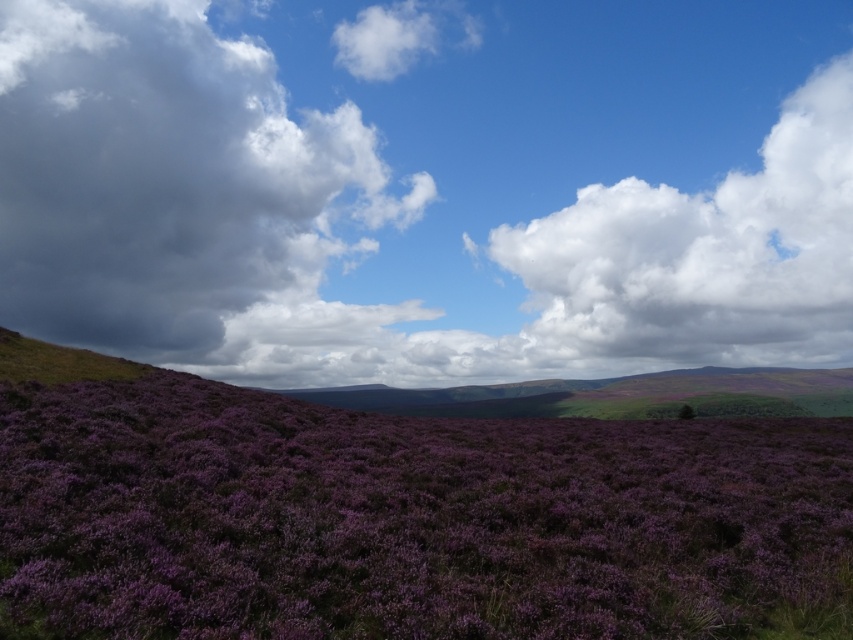
This screenshot has width=853, height=640. What do you see at coordinates (178, 193) in the screenshot? I see `dark gray fluffy cloud at left` at bounding box center [178, 193].

Identify the location of dark gray fluffy cloud at left. This screenshot has width=853, height=640. (178, 193).

Can you confirm if cloudy sky at upper center is wider than dark gray fluffy cloud at left?

Indeed, cloudy sky at upper center has a greater width compared to dark gray fluffy cloud at left.

Is point (676, 266) closer to camera compared to point (194, 221)?

No, (676, 266) is further to viewer.

The height and width of the screenshot is (640, 853). Find the location of `cloudy sky at upper center`. cloudy sky at upper center is located at coordinates (428, 189).

Does purple soft-textured lavender at center appear on the left side of white fluffy cloud at upper center?

No, purple soft-textured lavender at center is not to the left of white fluffy cloud at upper center.

Locate an element on the screen. The image size is (853, 640). purple soft-textured lavender at center is located at coordinates (408, 518).